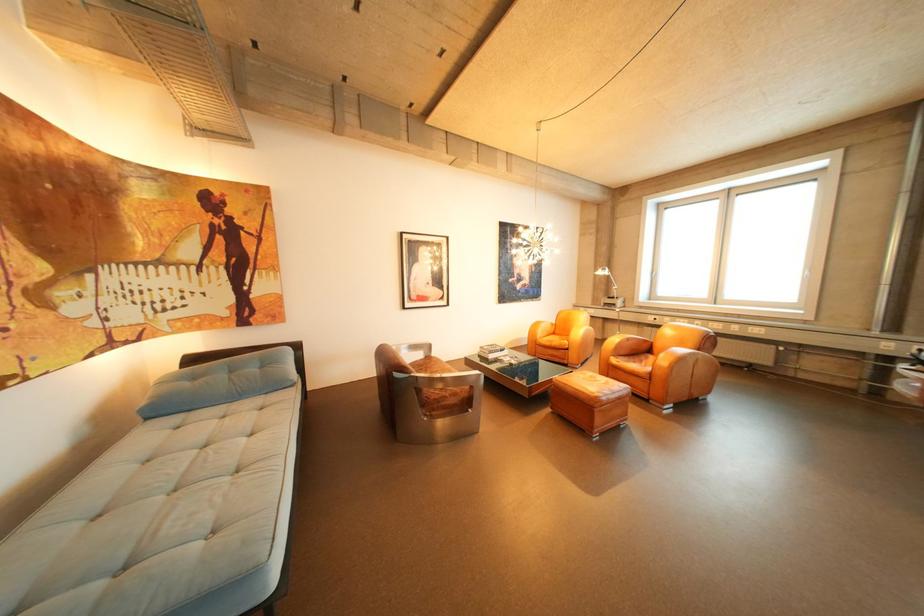
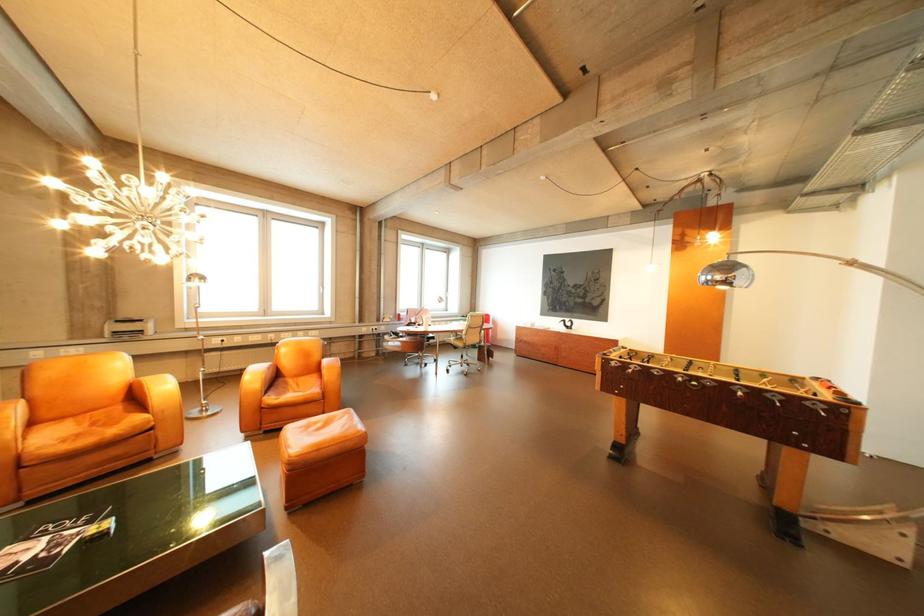
Where in the second image is the point corresponding to pixel 627 361 from the first image?

(285, 400)